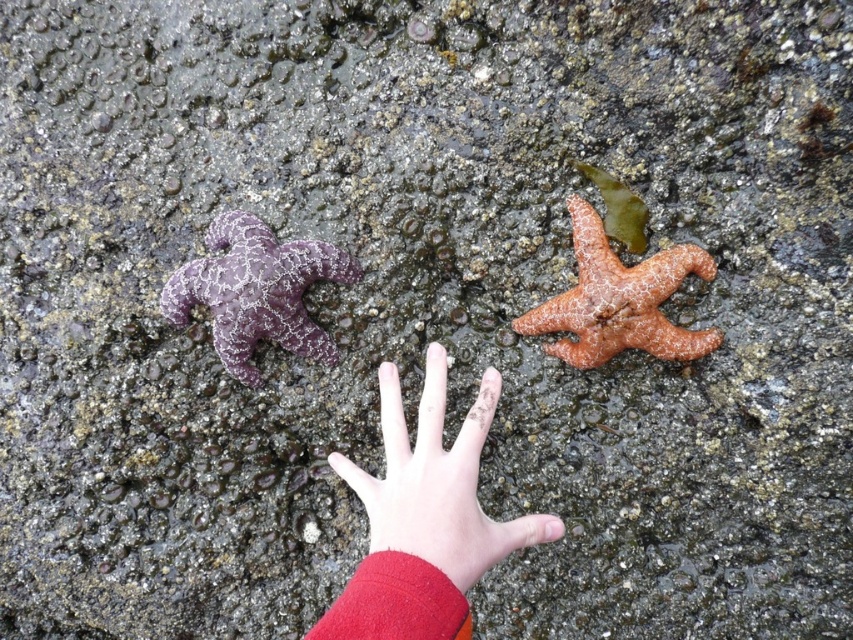
Question: Does smooth skin hand at center appear under purple matte starfish at left?

Choices:
 (A) no
 (B) yes

Answer: (B)

Question: Which object appears closest to the camera in this image?

Choices:
 (A) purple matte starfish at left
 (B) smooth skin hand at center
 (C) orange matte starfish at center right

Answer: (B)

Question: Is purple matte starfish at left smaller than orange matte starfish at center right?

Choices:
 (A) yes
 (B) no

Answer: (A)

Question: Which object is positioned farthest from the smooth skin hand at center?

Choices:
 (A) orange matte starfish at center right
 (B) purple matte starfish at left

Answer: (B)

Question: Which point is farther to the camera?

Choices:
 (A) orange matte starfish at center right
 (B) smooth skin hand at center
 (C) purple matte starfish at left

Answer: (C)

Question: Does smooth skin hand at center come behind purple matte starfish at left?

Choices:
 (A) no
 (B) yes

Answer: (A)